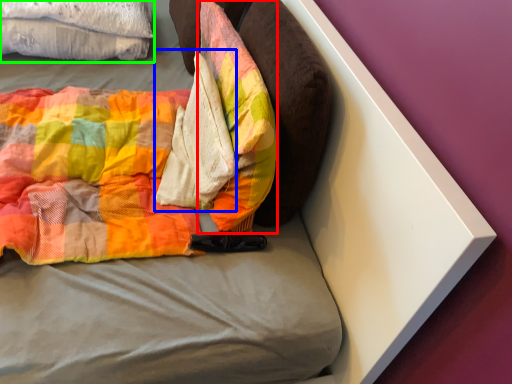
Question: Based on their relative distances, which object is nearer to pillow (highlighted by a red box)? Choose from material (highlighted by a blue box) and cloth (highlighted by a green box).

Choices:
 (A) material
 (B) cloth

Answer: (A)